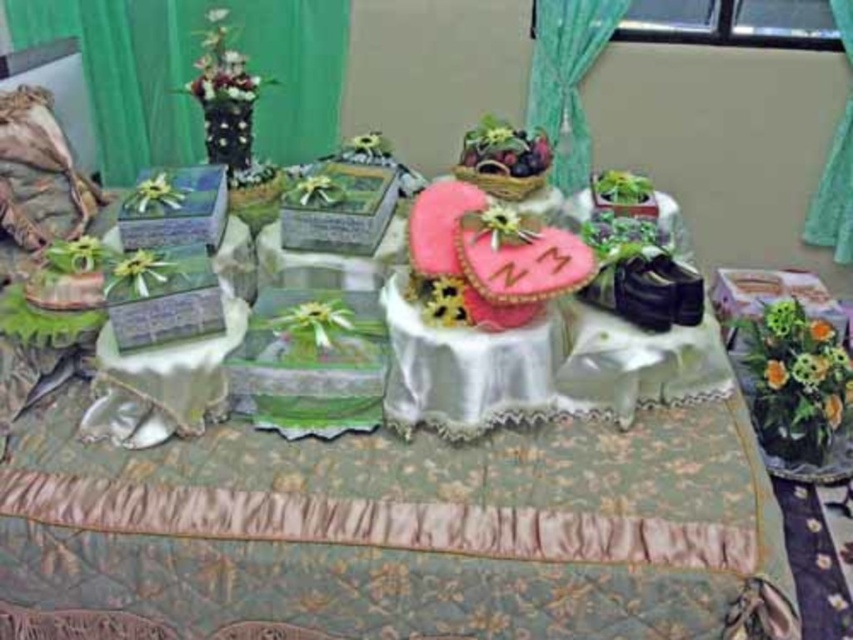
Does green sheer curtain at upper center come in front of green sheer curtain at upper right?

No.

Can you confirm if green sheer curtain at upper center is smaller than green sheer curtain at upper right?

Yes, green sheer curtain at upper center is smaller than green sheer curtain at upper right.

Is point (548, 125) farther from viewer compared to point (846, 10)?

Yes, point (548, 125) is farther from viewer.

Find the location of a particular element. This screenshot has width=853, height=640. green sheer curtain at upper center is located at coordinates (566, 77).

Measure the distance from green fabric curtain at upper left to green sheer curtain at upper right.

A distance of 2.31 meters exists between green fabric curtain at upper left and green sheer curtain at upper right.

Who is shorter, green fabric curtain at upper left or green sheer curtain at upper right?

green fabric curtain at upper left is shorter.

Locate an element on the screen. Image resolution: width=853 pixels, height=640 pixels. green fabric curtain at upper left is located at coordinates (195, 72).

This screenshot has height=640, width=853. What are the coordinates of `green fabric curtain at upper left` in the screenshot? It's located at 195,72.

Is silky white tablecloth at center further to camera compared to green sheer curtain at upper center?

No, it is in front of green sheer curtain at upper center.

The height and width of the screenshot is (640, 853). I want to click on silky white tablecloth at center, so click(x=398, y=486).

Locate an element on the screen. Image resolution: width=853 pixels, height=640 pixels. silky white tablecloth at center is located at coordinates (398, 486).